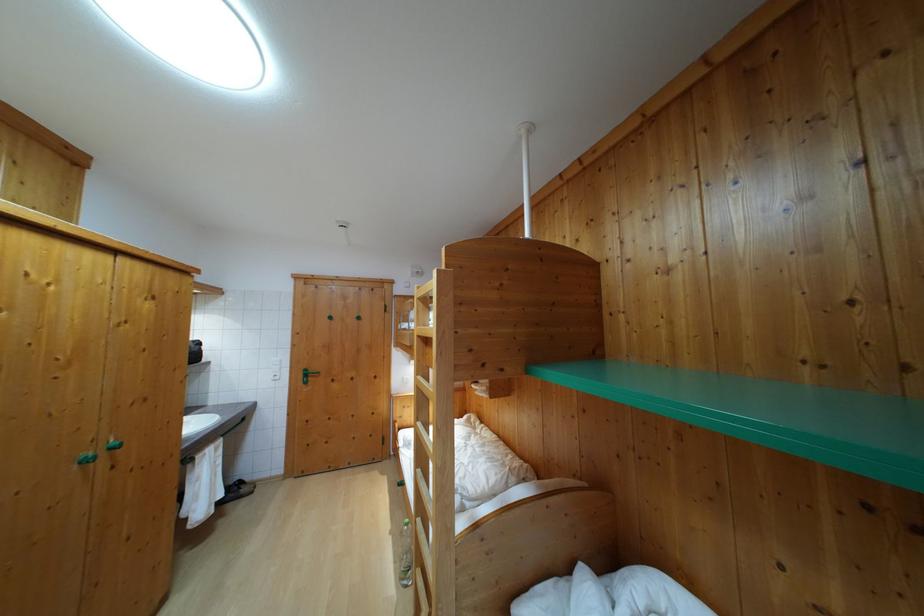
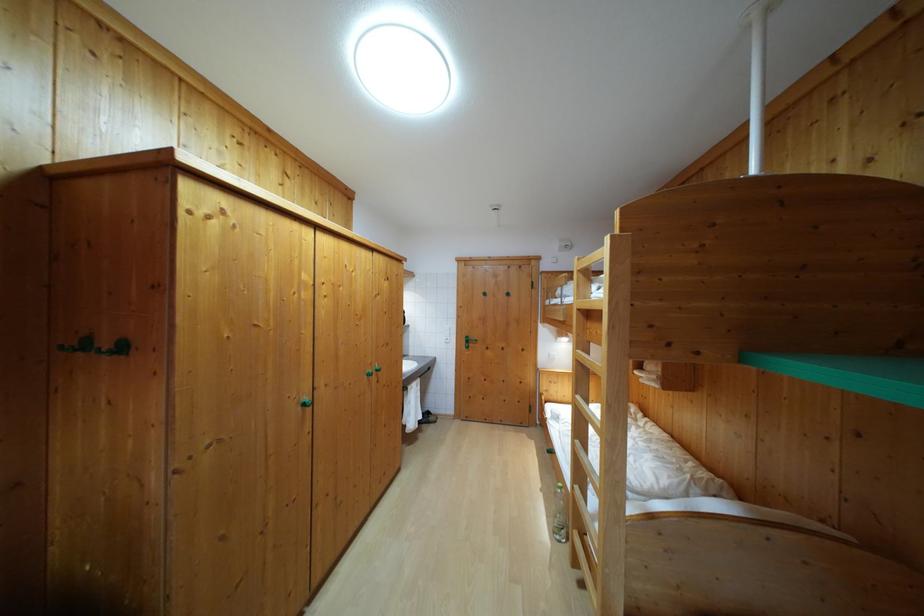
Question: The camera is either moving clockwise (left) or counter-clockwise (right) around the object. The first image is from the beginning of the video and the second image is from the end. Is the camera moving left or right when shooting the video?

Choices:
 (A) Left
 (B) Right

Answer: (B)